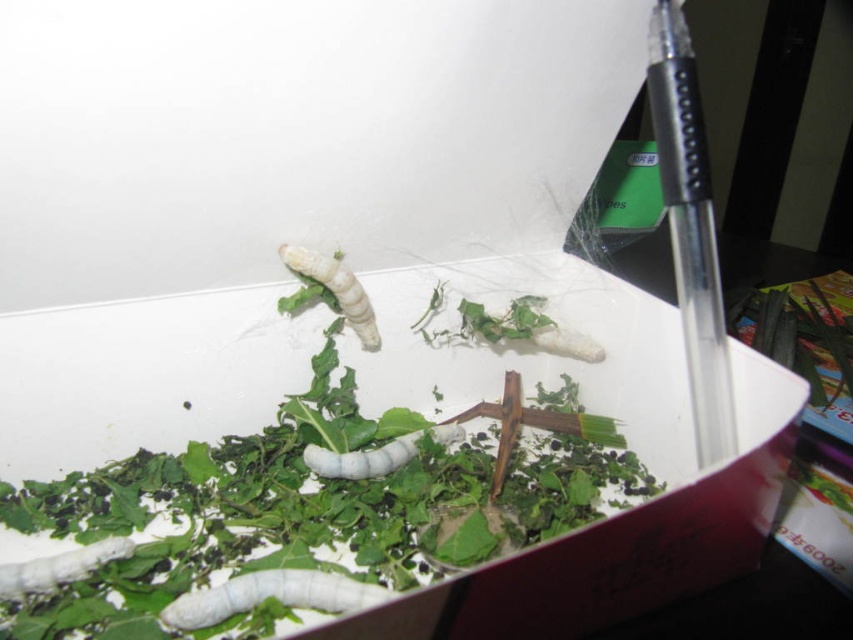
Question: Does green leafy plant at right appear under white fuzzy caterpillar at lower left?

Choices:
 (A) yes
 (B) no

Answer: (B)

Question: Is white matte caterpillar at center bigger than white matte worm at center?

Choices:
 (A) no
 (B) yes

Answer: (A)

Question: Can you confirm if white fuzzy caterpillar at lower left is positioned below white matte caterpillar at center?

Choices:
 (A) no
 (B) yes

Answer: (B)

Question: Among these points, which one is farthest from the camera?

Choices:
 (A) (815, 401)
 (B) (344, 458)

Answer: (A)

Question: Which object is the farthest from the white fuzzy caterpillar at lower left?

Choices:
 (A) green leafy plant at center
 (B) green leafy plant at right
 (C) white matte caterpillar at lower center
 (D) white matte caterpillar at center

Answer: (B)

Question: Which object is closer to the camera taking this photo?

Choices:
 (A) white matte worm at center
 (B) white fuzzy caterpillar at lower left
 (C) white matte caterpillar at center

Answer: (B)